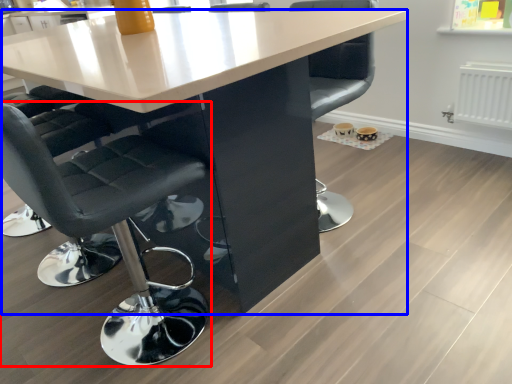
Question: Which object is closer to the camera taking this photo, chair (highlighted by a red box) or table (highlighted by a blue box)?

Choices:
 (A) chair
 (B) table

Answer: (B)